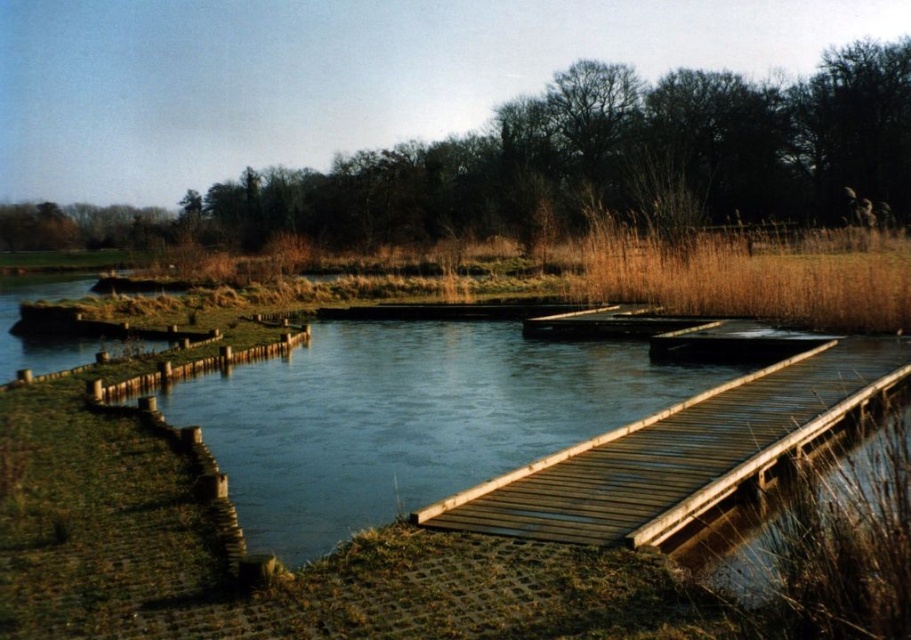
Does wooden dock at center have a lesser width compared to brown grass at upper right?

Correct, wooden dock at center's width is less than brown grass at upper right's.

Find the location of a particular element. wooden dock at center is located at coordinates (676, 452).